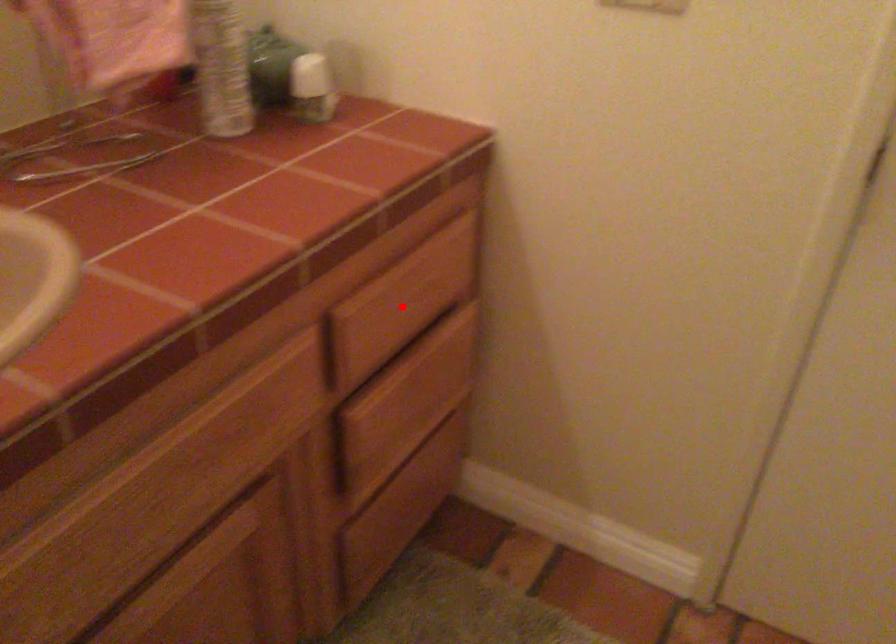
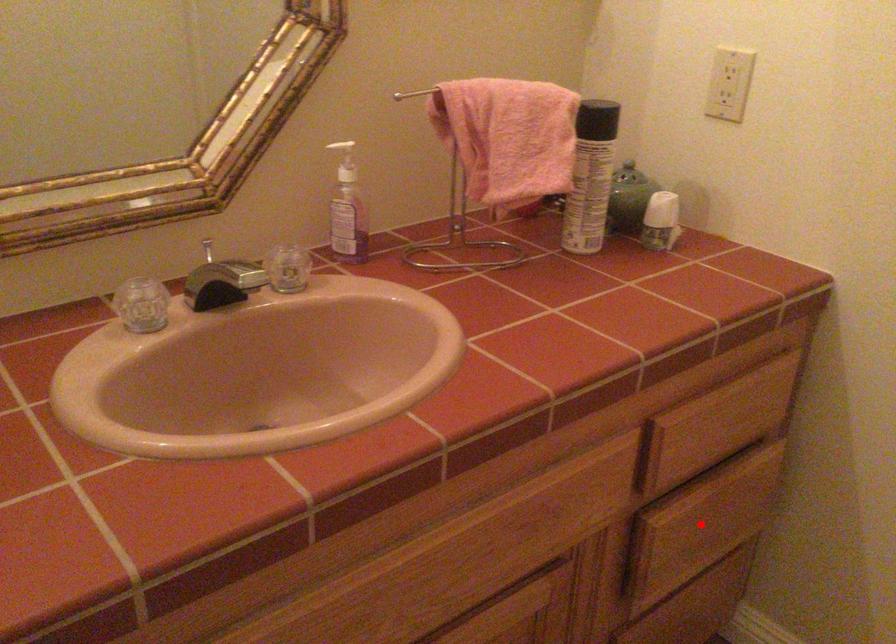
I am providing you with two images of the same scene from different viewpoints. A red point is marked on the first image and another point is marked on the second image. Is the red point in image1 aligned with the point shown in image2?

No